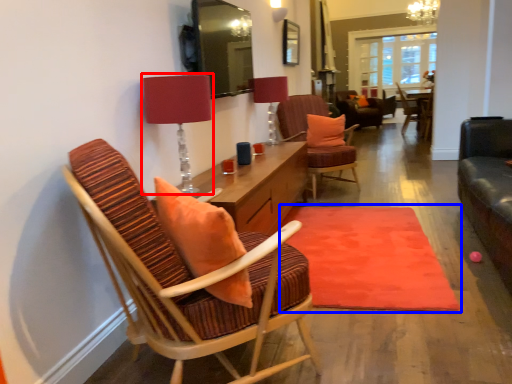
Question: Which of the following is the farthest to the observer, table lamp (highlighted by a red box) or mat (highlighted by a blue box)?

Choices:
 (A) table lamp
 (B) mat

Answer: (B)